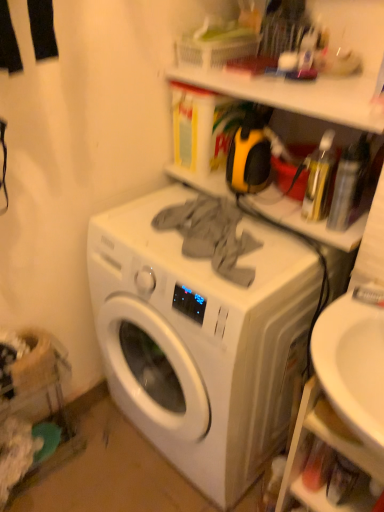
This screenshot has width=384, height=512. What do you see at coordinates (320, 76) in the screenshot?
I see `white plastic shelf at upper center, the third shelf from the bottom` at bounding box center [320, 76].

How much space does matte plastic shelf at upper center, which is counted as the second shelf, starting from the bottom, occupy horizontally?

The width of matte plastic shelf at upper center, which is counted as the second shelf, starting from the bottom, is 15.36 inches.

Measure the distance between white matte washing machine at center and camera.

The depth of white matte washing machine at center is 91.76 centimeters.

At what (x,y) coordinates should I click in order to perform the action: click on white plastic shelf at upper center, the third shelf from the bottom. Please return your answer as a coordinate pair (x, y). Image resolution: width=384 pixels, height=512 pixels. Looking at the image, I should click on tap(320, 76).

From the image's perspective, which one is positioned higher, white matte washing machine at center or matte plastic shelf at upper center, which is counted as the second shelf, starting from the bottom?

From the image's view, matte plastic shelf at upper center, which is counted as the second shelf, starting from the bottom, is above.

How different are the orientations of white matte washing machine at center and matte plastic shelf at upper center, which is counted as the second shelf, starting from the bottom, in degrees?

1.71 degrees.

In terms of width, does white matte washing machine at center look wider or thinner when compared to matte plastic shelf at upper center, which is counted as the second shelf, starting from the bottom?

Clearly, white matte washing machine at center has more width compared to matte plastic shelf at upper center, which is counted as the second shelf, starting from the bottom.

Is matte plastic shelf at upper center, which is counted as the second shelf, starting from the bottom, oriented towards white plastic shelf at lower right, arranged as the 1th shelf when ordered from the bottom?

No, matte plastic shelf at upper center, which is counted as the second shelf, starting from the bottom, is not aimed at white plastic shelf at lower right, arranged as the 1th shelf when ordered from the bottom.

Is matte plastic shelf at upper center, which is counted as the second shelf, starting from the bottom, taller than white plastic shelf at lower right, arranged as the 1th shelf when ordered from the bottom?

In fact, matte plastic shelf at upper center, which is counted as the second shelf, starting from the bottom, may be shorter than white plastic shelf at lower right, arranged as the 1th shelf when ordered from the bottom.

Is matte plastic shelf at upper center, which is counted as the second shelf, starting from the bottom, directly adjacent to white plastic shelf at lower right, arranged as the 1th shelf when ordered from the bottom?

No, matte plastic shelf at upper center, which is counted as the second shelf, starting from the bottom, is not next to white plastic shelf at lower right, arranged as the 1th shelf when ordered from the bottom.

From the matte plastic shelf at upper center, the 2th shelf positioned from the top, count 2nd shelf to the right and point to it. Please provide its 2D coordinates.

[(330, 447)]

From the image's perspective, is white matte washing machine at center under white plastic shelf at upper center, arranged as the 1th shelf when viewed from the top?

Yes.

Considering the positions of objects white matte washing machine at center and white plastic shelf at upper center, the third shelf from the bottom, in the image provided, who is more to the left, white matte washing machine at center or white plastic shelf at upper center, the third shelf from the bottom,?

Positioned to the left is white matte washing machine at center.

Is point (240, 371) farther from camera compared to point (333, 82)?

No, it is not.

There is a white matte washing machine at center. Where is `the 2nd shelf above it (from a real-world perspective)`? The height and width of the screenshot is (512, 384). the 2nd shelf above it (from a real-world perspective) is located at coordinates (320, 76).

From a real-world perspective, is white plastic shelf at upper center, arranged as the 1th shelf when viewed from the top, positioned under white plastic shelf at lower right, arranged as the 1th shelf when ordered from the bottom, based on gravity?

Actually, white plastic shelf at upper center, arranged as the 1th shelf when viewed from the top, is physically above white plastic shelf at lower right, arranged as the 1th shelf when ordered from the bottom, in the real world.

How different are the orientations of white plastic shelf at upper center, arranged as the 1th shelf when viewed from the top, and white plastic shelf at lower right, the 3th shelf viewed from the top, in degrees?

The facing directions of white plastic shelf at upper center, arranged as the 1th shelf when viewed from the top, and white plastic shelf at lower right, the 3th shelf viewed from the top, are 1.51 degrees apart.

Between white plastic shelf at upper center, arranged as the 1th shelf when viewed from the top, and white plastic shelf at lower right, arranged as the 1th shelf when ordered from the bottom, which one appears on the right side from the viewer's perspective?

white plastic shelf at lower right, arranged as the 1th shelf when ordered from the bottom.

Which point is more forward, (374, 24) or (289, 462)?

Positioned in front is point (289, 462).

What's the angular difference between white plastic shelf at lower right, arranged as the 1th shelf when ordered from the bottom, and matte plastic shelf at upper center, which is counted as the second shelf, starting from the bottom,'s facing directions?

They differ by 0.398 degrees in their facing directions.

Between white plastic shelf at lower right, the 3th shelf viewed from the top, and matte plastic shelf at upper center, the 2th shelf positioned from the top, which one has larger width?

matte plastic shelf at upper center, the 2th shelf positioned from the top, is wider.

Are white plastic shelf at lower right, the 3th shelf viewed from the top, and matte plastic shelf at upper center, which is counted as the second shelf, starting from the bottom, far apart?

No, there isn't a large distance between white plastic shelf at lower right, the 3th shelf viewed from the top, and matte plastic shelf at upper center, which is counted as the second shelf, starting from the bottom.

Which is more to the right, white plastic shelf at lower right, the 3th shelf viewed from the top, or white plastic shelf at upper center, the third shelf from the bottom?

white plastic shelf at lower right, the 3th shelf viewed from the top.

Can you tell me how much white plastic shelf at lower right, the 3th shelf viewed from the top, and white plastic shelf at upper center, arranged as the 1th shelf when viewed from the top, differ in facing direction?

1.51 degrees.

Looking at this image, does white plastic shelf at lower right, arranged as the 1th shelf when ordered from the bottom, have a lesser height compared to white plastic shelf at upper center, arranged as the 1th shelf when viewed from the top?

In fact, white plastic shelf at lower right, arranged as the 1th shelf when ordered from the bottom, may be taller than white plastic shelf at upper center, arranged as the 1th shelf when viewed from the top.

Which object is thinner, white matte washing machine at center or white plastic shelf at lower right, arranged as the 1th shelf when ordered from the bottom?

Thinner between the two is white plastic shelf at lower right, arranged as the 1th shelf when ordered from the bottom.

Considering their positions, is white matte washing machine at center located in front of or behind white plastic shelf at lower right, the 3th shelf viewed from the top?

In the image, white matte washing machine at center appears behind white plastic shelf at lower right, the 3th shelf viewed from the top.

Find the location of a particular element. The width and height of the screenshot is (384, 512). washing machine that is above the white plastic shelf at lower right, the 3th shelf viewed from the top (from the image's perspective) is located at coordinates click(x=202, y=333).

From the image's perspective, is white matte washing machine at center positioned above or below white plastic shelf at lower right, the 3th shelf viewed from the top?

From the image's perspective, white matte washing machine at center appears above white plastic shelf at lower right, the 3th shelf viewed from the top.

The height and width of the screenshot is (512, 384). Find the location of `washing machine directly beneath the matte plastic shelf at upper center, which is counted as the second shelf, starting from the bottom (from a real-world perspective)`. washing machine directly beneath the matte plastic shelf at upper center, which is counted as the second shelf, starting from the bottom (from a real-world perspective) is located at coordinates (202, 333).

The width and height of the screenshot is (384, 512). In order to click on shelf below the matte plastic shelf at upper center, the 2th shelf positioned from the top (from the image's perspective) in this screenshot , I will do `click(330, 447)`.

Based on their spatial positions, is white plastic shelf at lower right, arranged as the 1th shelf when ordered from the bottom, or white plastic shelf at upper center, the third shelf from the bottom, closer to matte plastic shelf at upper center, which is counted as the second shelf, starting from the bottom?

The object closer to matte plastic shelf at upper center, which is counted as the second shelf, starting from the bottom, is white plastic shelf at upper center, the third shelf from the bottom.

Considering their positions, is white plastic shelf at lower right, the 3th shelf viewed from the top, positioned closer to matte plastic shelf at upper center, the 2th shelf positioned from the top, than white matte washing machine at center?

Among the two, white matte washing machine at center is located nearer to matte plastic shelf at upper center, the 2th shelf positioned from the top.

Which object lies further to the anchor point white plastic shelf at lower right, the 3th shelf viewed from the top, white plastic shelf at upper center, the third shelf from the bottom, or white matte washing machine at center?

Based on the image, white plastic shelf at upper center, the third shelf from the bottom, appears to be further to white plastic shelf at lower right, the 3th shelf viewed from the top.

Estimate the real-world distances between objects in this image. Which object is further from white plastic shelf at upper center, arranged as the 1th shelf when viewed from the top, matte plastic shelf at upper center, which is counted as the second shelf, starting from the bottom, or white matte washing machine at center?

white matte washing machine at center is further to white plastic shelf at upper center, arranged as the 1th shelf when viewed from the top.

When comparing their distances from white plastic shelf at upper center, arranged as the 1th shelf when viewed from the top, does white matte washing machine at center or white plastic shelf at lower right, the 3th shelf viewed from the top, seem closer?

white matte washing machine at center.

When comparing their distances from white plastic shelf at lower right, arranged as the 1th shelf when ordered from the bottom, does white plastic shelf at upper center, arranged as the 1th shelf when viewed from the top, or matte plastic shelf at upper center, the 2th shelf positioned from the top, seem closer?

The object closer to white plastic shelf at lower right, arranged as the 1th shelf when ordered from the bottom, is matte plastic shelf at upper center, the 2th shelf positioned from the top.

Based on their spatial positions, is white plastic shelf at upper center, the third shelf from the bottom, or white plastic shelf at lower right, the 3th shelf viewed from the top, further from matte plastic shelf at upper center, which is counted as the second shelf, starting from the bottom?

white plastic shelf at lower right, the 3th shelf viewed from the top, is positioned further to the anchor matte plastic shelf at upper center, which is counted as the second shelf, starting from the bottom.

Considering their positions, is white plastic shelf at upper center, the third shelf from the bottom, positioned closer to white matte washing machine at center than white plastic shelf at lower right, the 3th shelf viewed from the top?

Based on the image, white plastic shelf at lower right, the 3th shelf viewed from the top, appears to be nearer to white matte washing machine at center.

Locate an element on the screen. Image resolution: width=384 pixels, height=512 pixels. shelf between white plastic shelf at upper center, the third shelf from the bottom, and white matte washing machine at center from top to bottom is located at coordinates (297, 94).

Identify the location of washing machine between matte plastic shelf at upper center, which is counted as the second shelf, starting from the bottom, and white plastic shelf at lower right, arranged as the 1th shelf when ordered from the bottom, vertically. Image resolution: width=384 pixels, height=512 pixels. (202, 333).

Find the location of a particular element. This screenshot has height=512, width=384. shelf between white plastic shelf at upper center, arranged as the 1th shelf when viewed from the top, and white plastic shelf at lower right, the 3th shelf viewed from the top, in the vertical direction is located at coordinates (297, 94).

Identify the location of washing machine between white plastic shelf at upper center, arranged as the 1th shelf when viewed from the top, and white plastic shelf at lower right, the 3th shelf viewed from the top, in the vertical direction. (202, 333).